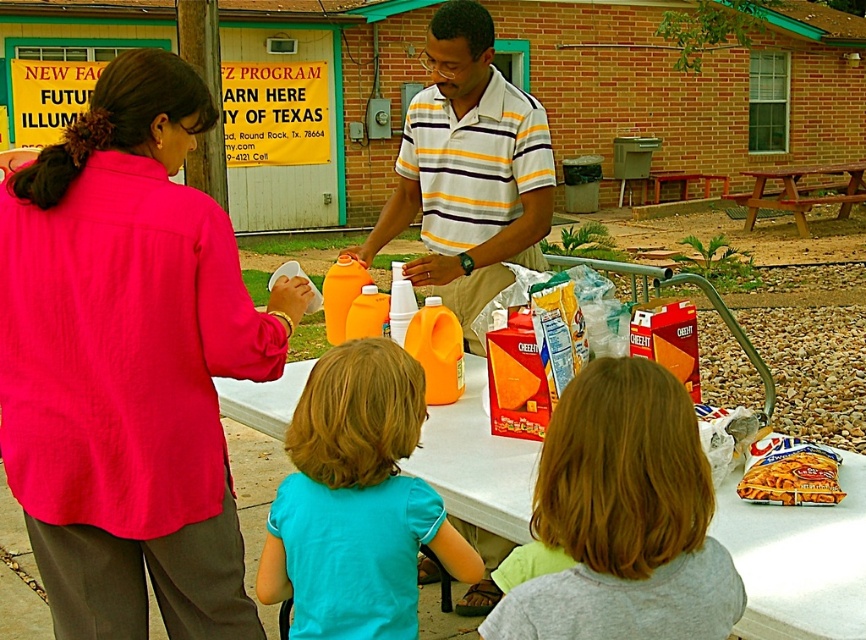
Does teal cotton shirt at center appear under white plastic table at lower center?

Indeed, teal cotton shirt at center is positioned under white plastic table at lower center.

Is point (382, 595) positioned behind point (810, 627)?

Yes, point (382, 595) is behind point (810, 627).

Identify the location of teal cotton shirt at center. This screenshot has width=866, height=640. (356, 500).

Between striped cotton shirt at center and striped cotton polo shirt at center, which one has more height?

With more height is striped cotton shirt at center.

Can you confirm if striped cotton shirt at center is positioned above striped cotton polo shirt at center?

No, striped cotton shirt at center is not above striped cotton polo shirt at center.

What do you see at coordinates (469, 170) in the screenshot? The image size is (866, 640). I see `striped cotton shirt at center` at bounding box center [469, 170].

In order to click on striped cotton shirt at center in this screenshot , I will do `click(469, 170)`.

Is matte orange juice carton at center positioned before wooden picnic table at center?

Yes.

Does matte orange juice carton at center lie behind wooden picnic table at center?

No, it is in front of wooden picnic table at center.

Does point (806, 493) come closer to viewer compared to point (772, 172)?

Yes, it is.

At what (x,y) coordinates should I click in order to perform the action: click on matte orange juice carton at center. Please return your answer as a coordinate pair (x, y). Looking at the image, I should click on (793, 477).